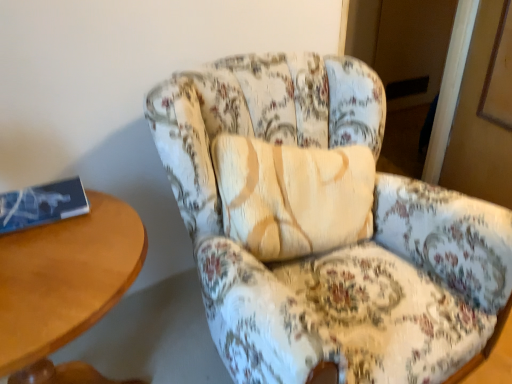
Question: Is floral fabric armchair at center next to wooden table at left and touching it?

Choices:
 (A) no
 (B) yes

Answer: (A)

Question: Is the depth of floral fabric armchair at center greater than that of wooden table at left?

Choices:
 (A) no
 (B) yes

Answer: (A)

Question: Is floral fabric armchair at center outside of wooden table at left?

Choices:
 (A) no
 (B) yes

Answer: (B)

Question: From the image's perspective, does floral fabric armchair at center appear lower than wooden table at left?

Choices:
 (A) yes
 (B) no

Answer: (B)

Question: Is floral fabric armchair at center bigger than wooden table at left?

Choices:
 (A) yes
 (B) no

Answer: (A)

Question: Is wooden table at left spatially inside floral fabric armchair at center, or outside of it?

Choices:
 (A) inside
 (B) outside

Answer: (B)

Question: Considering the positions of wooden table at left and floral fabric armchair at center in the image, is wooden table at left taller or shorter than floral fabric armchair at center?

Choices:
 (A) short
 (B) tall

Answer: (A)

Question: From the image's perspective, is wooden table at left positioned above or below floral fabric armchair at center?

Choices:
 (A) above
 (B) below

Answer: (B)

Question: Considering the positions of point (x=89, y=284) and point (x=202, y=205), is point (x=89, y=284) closer or farther from the camera than point (x=202, y=205)?

Choices:
 (A) farther
 (B) closer

Answer: (B)

Question: Looking at the image, does floral fabric armchair at center seem bigger or smaller compared to wooden table at left?

Choices:
 (A) big
 (B) small

Answer: (A)

Question: Considering the positions of floral fabric armchair at center and wooden table at left in the image, is floral fabric armchair at center wider or thinner than wooden table at left?

Choices:
 (A) wide
 (B) thin

Answer: (A)

Question: Relative to wooden table at left, is floral fabric armchair at center in front or behind?

Choices:
 (A) behind
 (B) front

Answer: (B)

Question: Would you say floral fabric armchair at center is to the left or to the right of wooden table at left in the picture?

Choices:
 (A) left
 (B) right

Answer: (B)

Question: Is blue paper book at left bigger or smaller than floral fabric armchair at center?

Choices:
 (A) big
 (B) small

Answer: (B)

Question: Visually, is blue paper book at left positioned to the left or to the right of floral fabric armchair at center?

Choices:
 (A) right
 (B) left

Answer: (B)